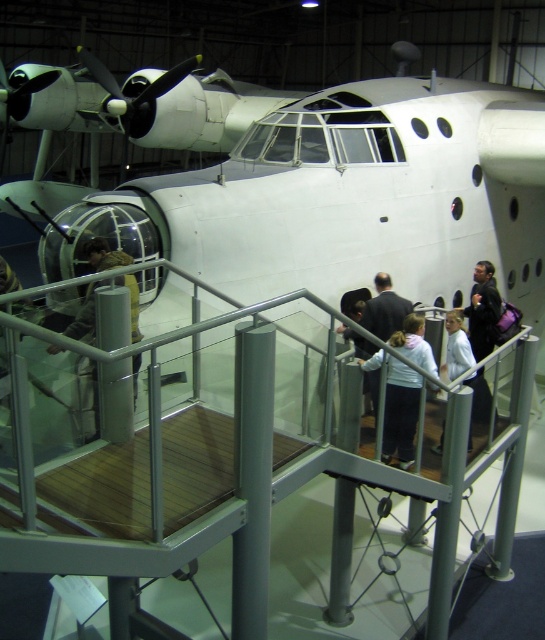
Does white fleece jacket at center have a greater width compared to white cotton jacket at center?

Correct, the width of white fleece jacket at center exceeds that of white cotton jacket at center.

Does point (405, 324) come behind point (467, 369)?

No, it is in front of (467, 369).

Find the location of a particular element. white fleece jacket at center is located at coordinates (401, 412).

Can you confirm if light gray sweater at right is shorter than white cotton jacket at center?

In fact, light gray sweater at right may be taller than white cotton jacket at center.

Does point (485, 397) lie behind point (467, 385)?

Yes.

Where is `light gray sweater at right`? light gray sweater at right is located at coordinates (483, 310).

Who is higher up, white matte airplane at upper center or camouflage fabric jacket at center?

white matte airplane at upper center

Does white matte airplane at upper center have a larger size compared to camouflage fabric jacket at center?

No.

Find the location of a particular element. The width and height of the screenshot is (545, 640). white matte airplane at upper center is located at coordinates click(334, 189).